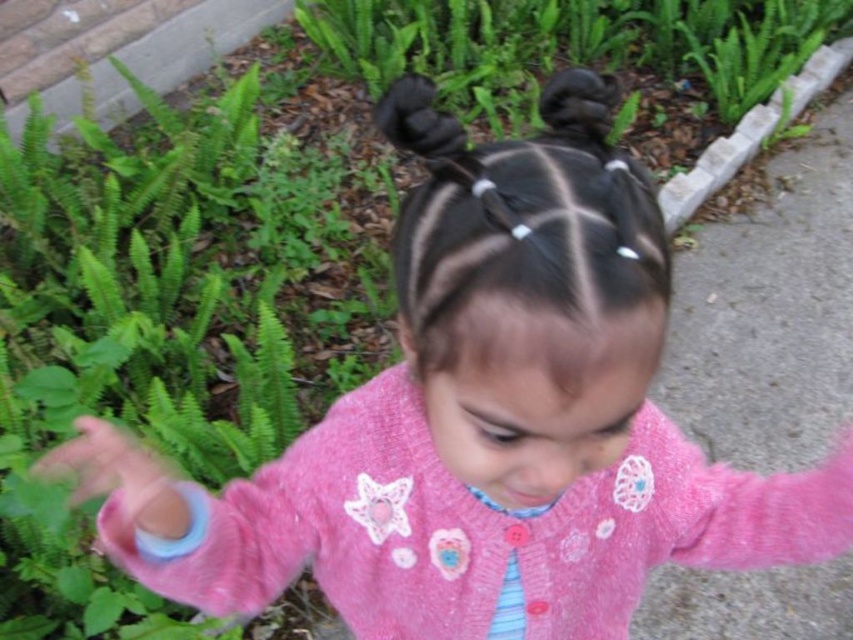
Question: Does pink fabric hand at lower left have a greater width compared to black hair at upper center?

Choices:
 (A) yes
 (B) no

Answer: (A)

Question: Which point appears closest to the camera in this image?

Choices:
 (A) (88, 417)
 (B) (595, 141)

Answer: (B)

Question: Can you confirm if pink fabric hand at lower left is bigger than black hair at upper center?

Choices:
 (A) yes
 (B) no

Answer: (A)

Question: Among these points, which one is farthest from the camera?

Choices:
 (A) (164, 508)
 (B) (581, 120)

Answer: (A)

Question: Considering the relative positions of pink fabric hand at lower left and black hair at upper center in the image provided, where is pink fabric hand at lower left located with respect to black hair at upper center?

Choices:
 (A) above
 (B) below

Answer: (B)